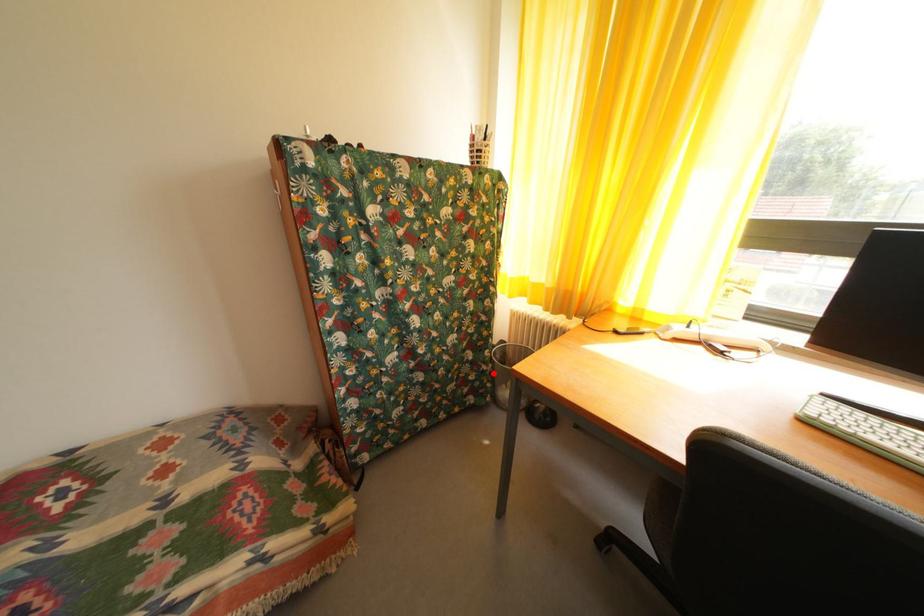
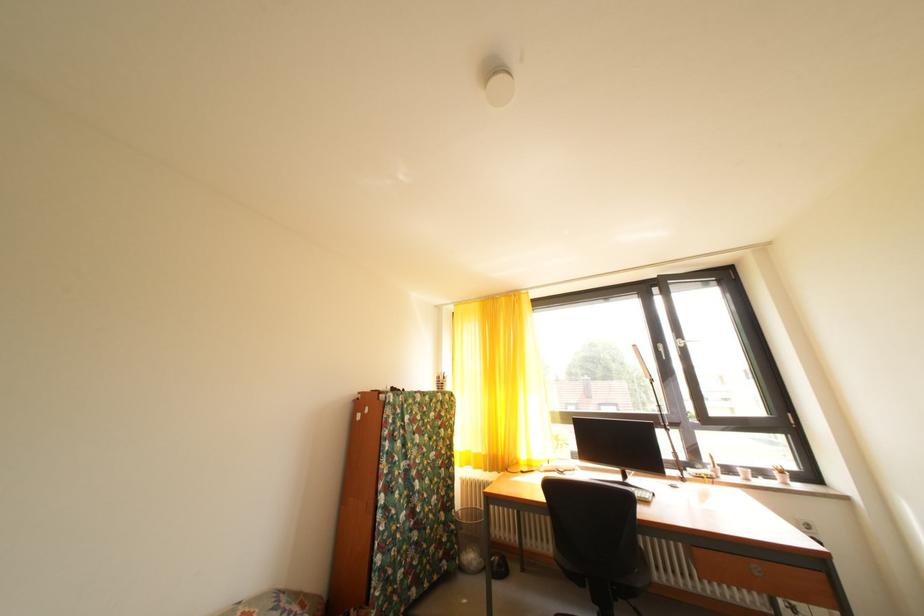
In the second image, find the point that corresponds to the highlighted location in the first image.

(462, 533)